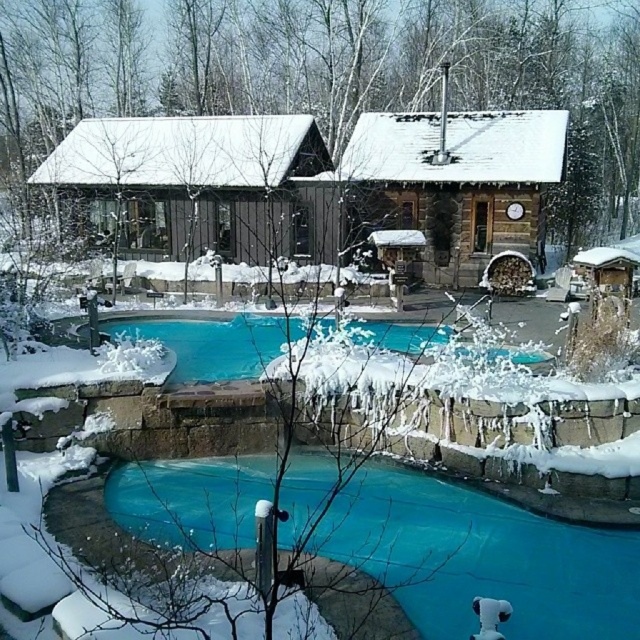
You are planning to place a new rectangular garden bed that is 10 feet wide between the blue tarp at lower center and the brown wooden cabin at center. Considering their widths, will the garden bed fit between them?

The blue tarp at lower center is narrower than the brown wooden cabin at center. Since the garden bed is 10 feet wide, it depends on the actual distance between them, but based on width comparison alone, the cabin is wider so the garden bed might fit if positioned correctly.